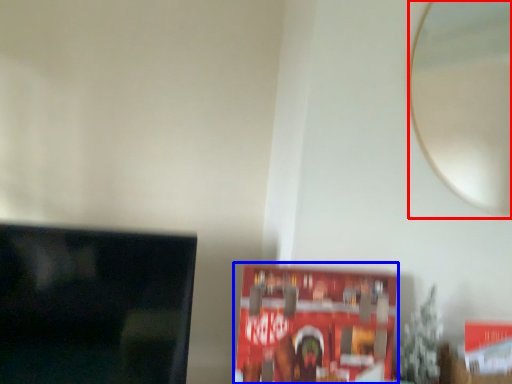
Question: Among these objects, which one is farthest to the camera, mirror (highlighted by a red box) or paperback book (highlighted by a blue box)?

Choices:
 (A) mirror
 (B) paperback book

Answer: (A)